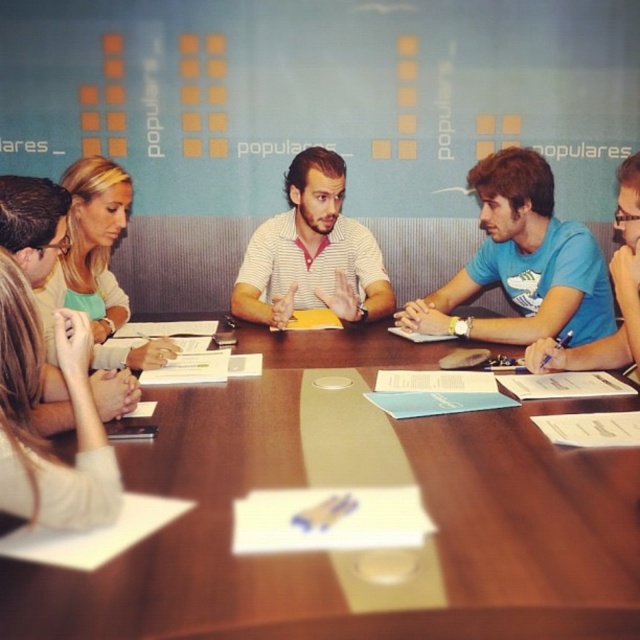
You are a photographer standing at a certain position and want to capture a closeup of the wooden table at center. The camera you are using has a minimum focusing distance of 60 centimeters. Can you take the closeup without moving closer?

The wooden table at center and camera are 69.01 centimeters apart. Since the minimum focusing distance is 60 centimeters, the photographer can take the closeup without moving closer because the distance is within the camera s capability.

You are a participant in the meeting and want to pass a document to the person at point (122, 204). You are currently at point (579, 284). Which direction should you move to reach them?

Since point (579, 284) is in front of point (122, 204), you should move backward to reach the person at point (122, 204).

You are a photographer trying to capture a group photo of the meeting participants. You notice the blue matte shirt at center and the blonde hair at upper left. Which object should you adjust in your camera frame to ensure both are fully visible?

The blue matte shirt at center is much taller than the blonde hair at upper left, so you should adjust the camera frame to accommodate the height of the blue matte shirt at center to ensure both are fully visible.